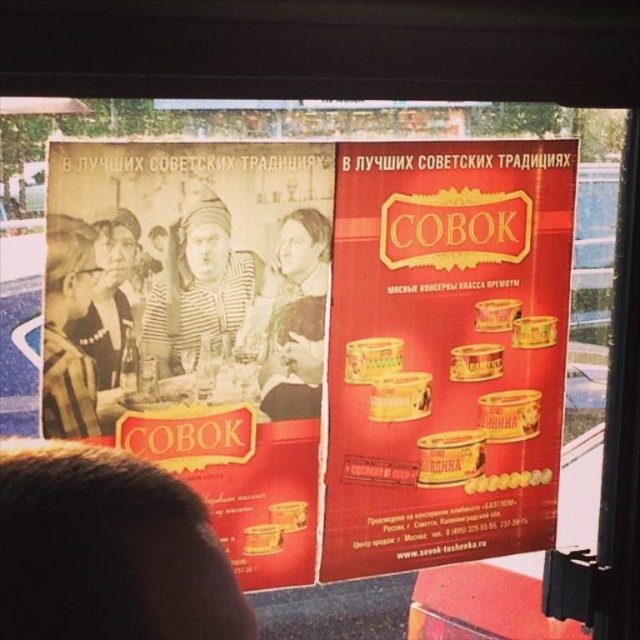
Does sepia paper poster at center appear under matte black headscarf at upper left?

Correct, sepia paper poster at center is located below matte black headscarf at upper left.

Does sepia paper poster at center have a lesser width compared to matte black headscarf at upper left?

No.

Does point (310, 448) come in front of point (102, 268)?

No, (310, 448) is behind (102, 268).

At what (x,y) coordinates should I click in order to perform the action: click on sepia paper poster at center. Please return your answer as a coordinate pair (x, y). Looking at the image, I should click on (196, 324).

Is sepia paper poster at center positioned behind yellow matte can at lower right?

No, it is not.

Which is behind, point (284, 328) or point (493, 486)?

Point (493, 486)

You are a GUI agent. You are given a task and a screenshot of the screen. Output one action in this format:
    pyautogui.click(x=<x>, y=<y>)
    Task: Click on the sepia paper poster at center
    The height and width of the screenshot is (640, 640).
    Given the screenshot: What is the action you would take?
    pyautogui.click(x=196, y=324)

Between red matte can at center and matte black headscarf at upper left, which one is positioned higher?

Positioned higher is matte black headscarf at upper left.

Can you confirm if red matte can at center is smaller than matte black headscarf at upper left?

No, red matte can at center is not smaller than matte black headscarf at upper left.

Find the location of a particular element. This screenshot has width=640, height=640. red matte can at center is located at coordinates (444, 349).

Identify the location of red matte can at center. (444, 349).